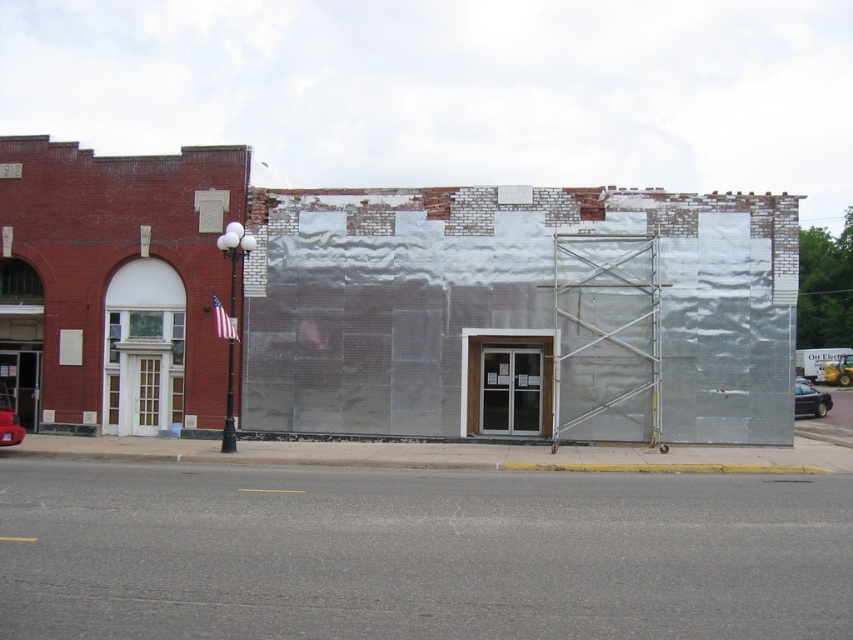
You are standing at the center of the image. Which direction should you walk to reach the shiny black sedan at lower right?

Since the shiny black sedan at lower right is located at point (810, 400) in the image, which is towards the lower right corner, you should walk towards the lower right direction to reach it.

You are a delivery driver and need to park your vehicle in the parking spot near the entrance of the building. The parking spot is only wide enough for a compact car. You have a shiny black sedan at lower right and a metallic red car at lower left. Which car should you choose to park in the spot?

You should choose the metallic red car at lower left because the shiny black sedan at lower right is bigger and would not fit in the compact parking spot.

Based on the photo, you are a delivery person trying to park your van between the shiny black sedan at lower right and the metallic red car at lower left. Your van is 2.2 meters tall. Can you fit your van between them without hitting the roof?

The shiny black sedan at lower right is taller than the metallic red car at lower left. Since your van is 2.2 meters tall, you need to check the height of the lower car. However, the description only states that the shiny black sedan is taller, but does not provide specific measurements for either vehicle. Without knowing the exact height of the metallic red car, it is uncertain if the van will fit. Please verify the height of the metallic red car before proceeding.